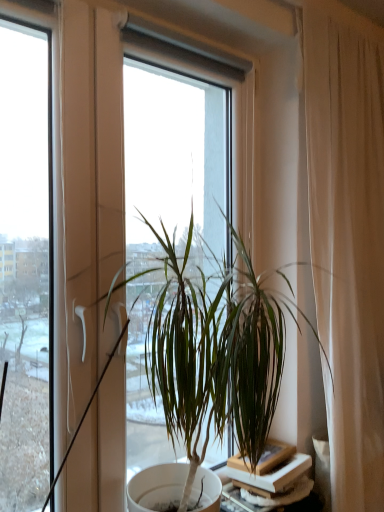
Question: Is white matte table at lower right surrounding green leafy plant at center?

Choices:
 (A) no
 (B) yes

Answer: (A)

Question: Is white matte table at lower right located outside green leafy plant at center?

Choices:
 (A) yes
 (B) no

Answer: (A)

Question: Is white matte table at lower right bigger than green leafy plant at center?

Choices:
 (A) no
 (B) yes

Answer: (A)

Question: Would you consider white matte table at lower right to be distant from green leafy plant at center?

Choices:
 (A) yes
 (B) no

Answer: (B)

Question: Considering the relative sizes of white matte table at lower right and green leafy plant at center in the image provided, is white matte table at lower right thinner than green leafy plant at center?

Choices:
 (A) no
 (B) yes

Answer: (B)

Question: Considering the relative sizes of white matte table at lower right and green leafy plant at center in the image provided, is white matte table at lower right shorter than green leafy plant at center?

Choices:
 (A) yes
 (B) no

Answer: (A)

Question: From the image's perspective, is green leafy plant at center below white matte table at lower right?

Choices:
 (A) no
 (B) yes

Answer: (A)

Question: Could you tell me if green leafy plant at center is facing white matte table at lower right?

Choices:
 (A) yes
 (B) no

Answer: (B)

Question: From a real-world perspective, is green leafy plant at center located higher than white matte table at lower right?

Choices:
 (A) no
 (B) yes

Answer: (B)

Question: Is green leafy plant at center wider than white matte table at lower right?

Choices:
 (A) yes
 (B) no

Answer: (A)

Question: Can you confirm if green leafy plant at center is taller than white matte table at lower right?

Choices:
 (A) yes
 (B) no

Answer: (A)

Question: Considering the relative sizes of green leafy plant at center and white matte table at lower right in the image provided, is green leafy plant at center shorter than white matte table at lower right?

Choices:
 (A) no
 (B) yes

Answer: (A)

Question: Is white matte table at lower right taller or shorter than green leafy plant at center?

Choices:
 (A) tall
 (B) short

Answer: (B)